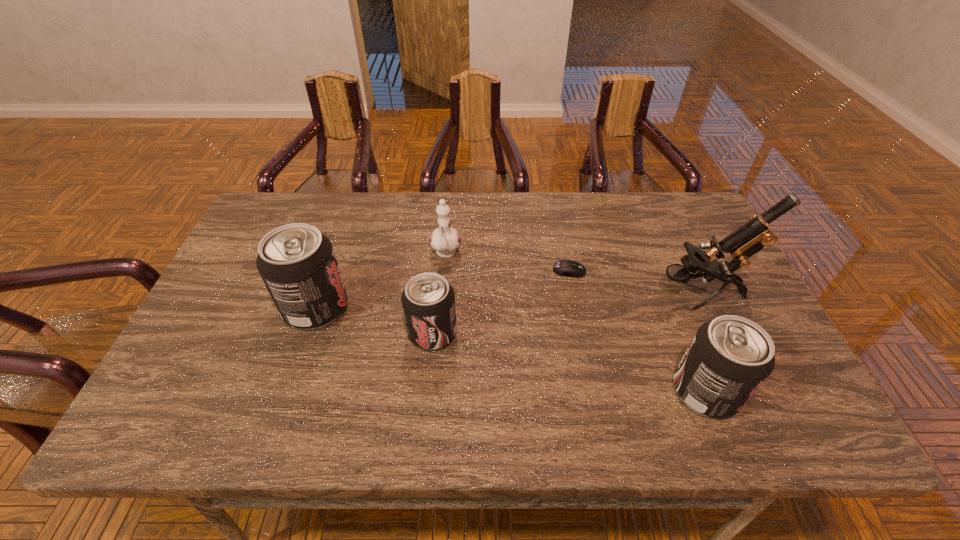
Please point a location where one more pop_(soda) can be added evenly. Please provide its 2D coordinates. Your answer should be formatted as a tuple, i.e. [(x, y)], where the tuple contains the x and y coordinates of a point satisfying the conditions above.

[(562, 360)]